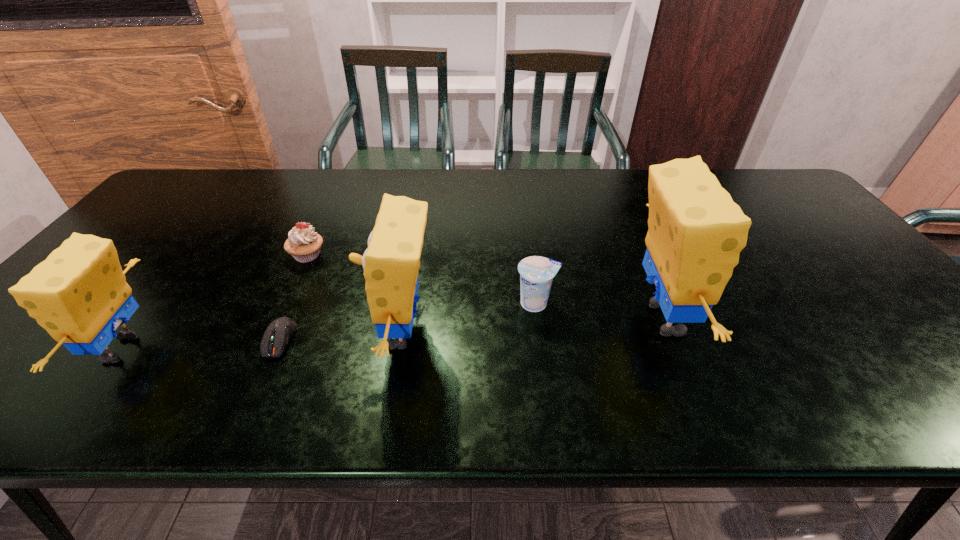
The height and width of the screenshot is (540, 960). What are the coordinates of `vacant point located between the yogurt and the leftmost object` in the screenshot? It's located at (329, 326).

Identify which object is located as the second nearest to the yogurt. Please provide its 2D coordinates. Your answer should be formatted as a tuple, i.e. [(x, y)], where the tuple contains the x and y coordinates of a point satisfying the conditions above.

[(391, 263)]

At what (x,y) coordinates should I click in order to perform the action: click on object identified as the second closest to the fifth shortest object. Please return your answer as a coordinate pair (x, y). The width and height of the screenshot is (960, 540). Looking at the image, I should click on (304, 244).

This screenshot has height=540, width=960. What are the coordinates of `sponge that stands as the second closest to the fourth shortest object` in the screenshot? It's located at (696, 232).

The height and width of the screenshot is (540, 960). In order to click on sponge identified as the third closest to the cupcake in this screenshot , I will do `click(696, 232)`.

Where is `vacant space that satisfies the following two spatial constraints: 1. on the button of the shortest object; 2. on the face of the third tallest object`? Image resolution: width=960 pixels, height=540 pixels. vacant space that satisfies the following two spatial constraints: 1. on the button of the shortest object; 2. on the face of the third tallest object is located at coordinates (276, 349).

At what (x,y) coordinates should I click in order to perform the action: click on vacant area in the image that satisfies the following two spatial constraints: 1. on the face of the third object from right to left; 2. on the button of the shortest object. Please return your answer as a coordinate pair (x, y). Looking at the image, I should click on (400, 339).

Image resolution: width=960 pixels, height=540 pixels. I want to click on free space that satisfies the following two spatial constraints: 1. on the button of the shortest object; 2. on the face of the leftmost sponge, so click(x=276, y=349).